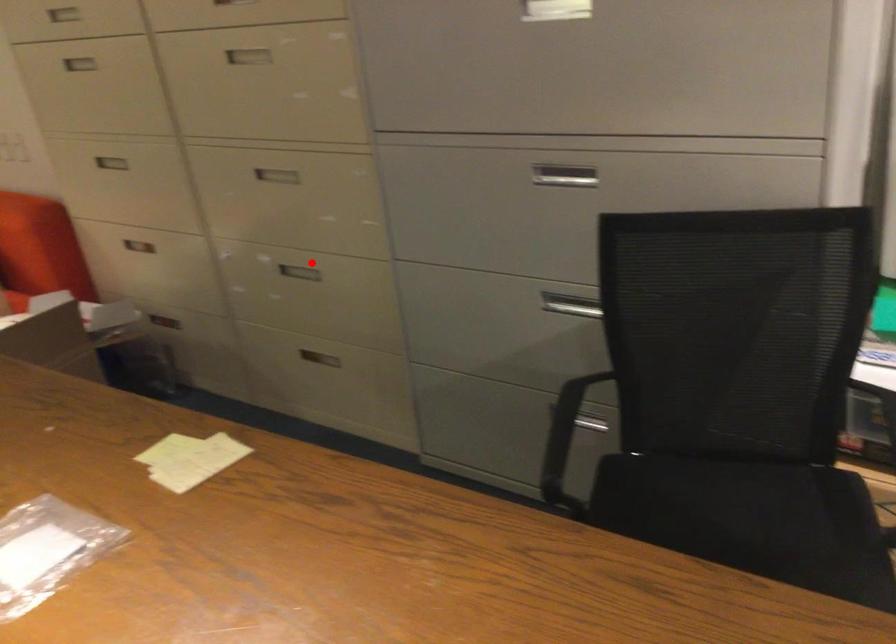
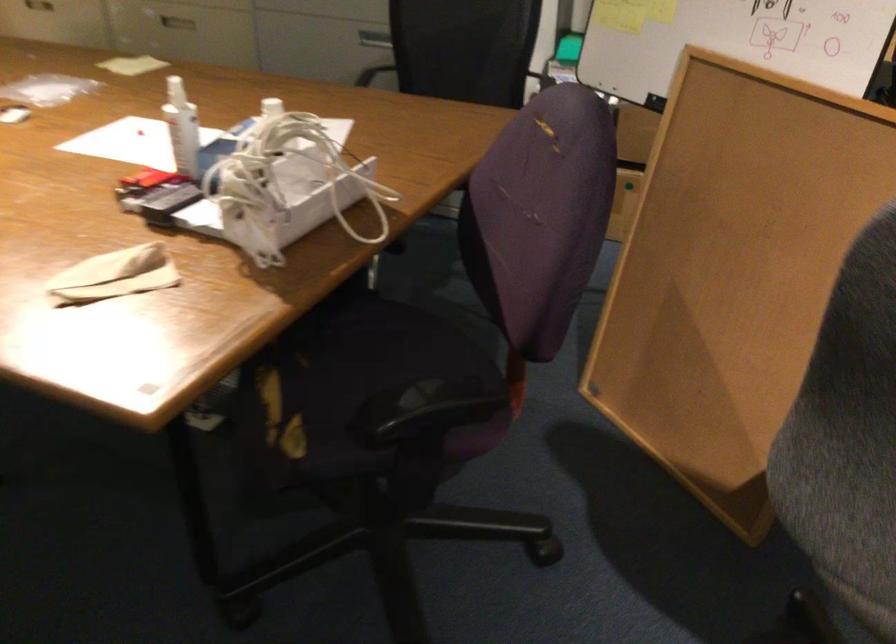
Find the pixel in the second image that matches the highlighted location in the first image.

(177, 19)